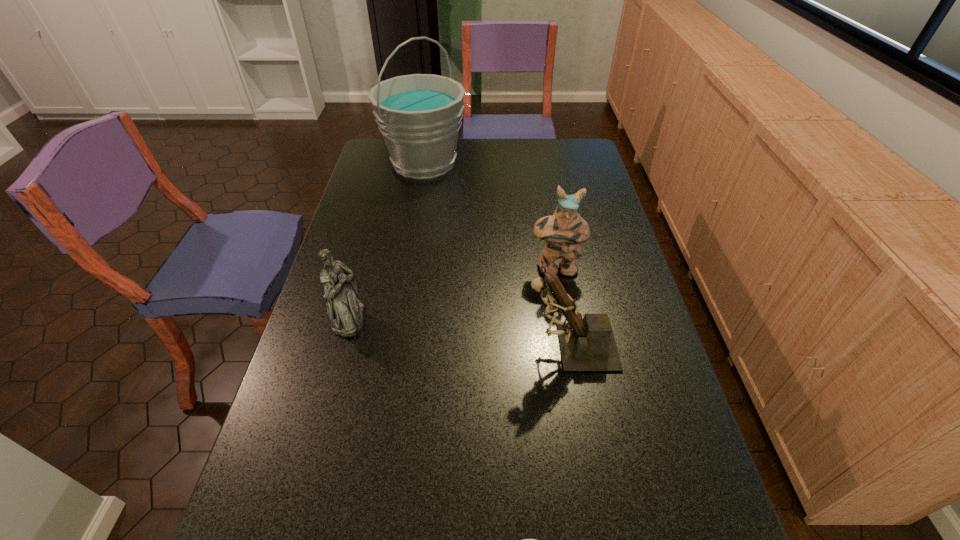
I want to click on the tallest object, so click(x=419, y=116).

Find the location of a particular element. the farthest object is located at coordinates (419, 116).

Where is `the fourth nearest object`? The width and height of the screenshot is (960, 540). the fourth nearest object is located at coordinates (564, 231).

Find the location of a particular element. The width and height of the screenshot is (960, 540). the second shortest object is located at coordinates (344, 309).

This screenshot has width=960, height=540. I want to click on the leftmost figurine, so click(344, 309).

Locate an element on the screen. vacant region located on the front of the farthest object is located at coordinates (419, 196).

The image size is (960, 540). Identify the location of free space located on the front-facing side of the fourth nearest object. (561, 298).

Find the location of a particular element. The image size is (960, 540). vacant area situated 0.290m on the front-facing side of the leftmost figurine is located at coordinates (470, 319).

This screenshot has width=960, height=540. Identify the location of object that is at the far edge. (419, 116).

Find the location of `bucket that is at the left edge`. bucket that is at the left edge is located at coordinates (419, 116).